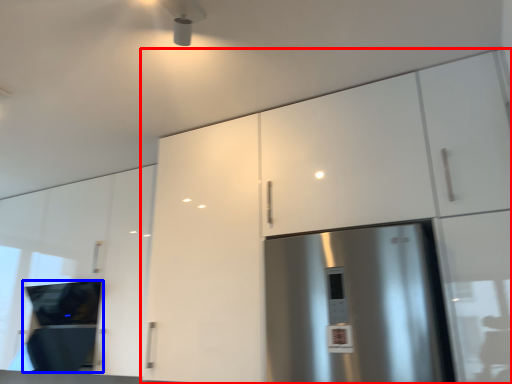
Question: Which of the following is the farthest to the observer, cabinetry (highlighted by a red box) or appliance (highlighted by a blue box)?

Choices:
 (A) cabinetry
 (B) appliance

Answer: (B)